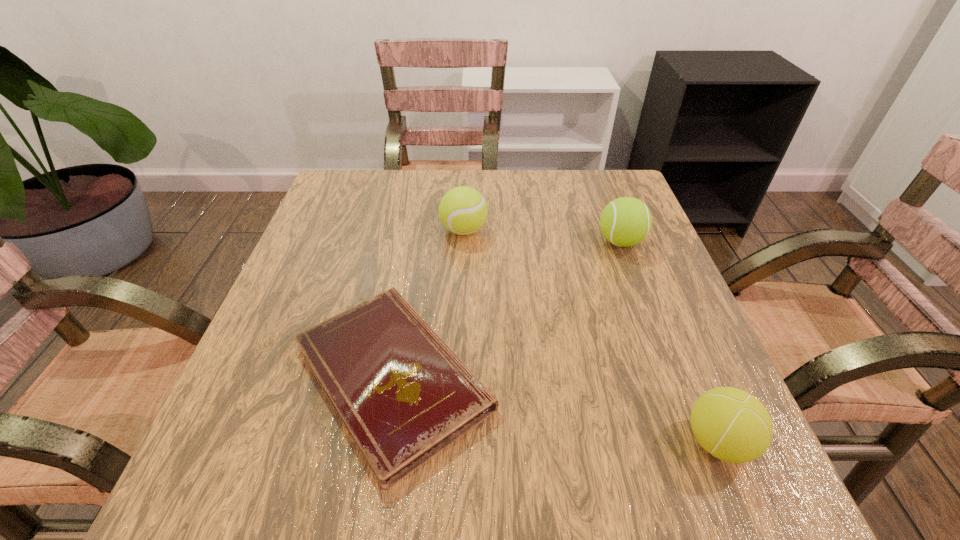
Find the location of `vacant area that lies between the notebook and the nearest tennis ball`. vacant area that lies between the notebook and the nearest tennis ball is located at coordinates click(555, 409).

At what (x,y) coordinates should I click in order to perform the action: click on object identified as the second closest to the notebook. Please return your answer as a coordinate pair (x, y). Looking at the image, I should click on (626, 221).

Find the location of `object that can be found as the third closest to the nearest tennis ball`. object that can be found as the third closest to the nearest tennis ball is located at coordinates (463, 210).

In order to click on tennis ball object that ranks as the closest to the nearest tennis ball in this screenshot , I will do `click(626, 221)`.

You are a GUI agent. You are given a task and a screenshot of the screen. Output one action in this format:
    pyautogui.click(x=<x>, y=<y>)
    Task: Click on the tennis ball that is the nearest to the leftmost tennis ball
    The width and height of the screenshot is (960, 540).
    Given the screenshot: What is the action you would take?
    pyautogui.click(x=626, y=221)

Locate an element on the screen. This screenshot has width=960, height=540. free location that satisfies the following two spatial constraints: 1. on the front side of the nearest tennis ball; 2. on the left side of the leftmost tennis ball is located at coordinates (454, 441).